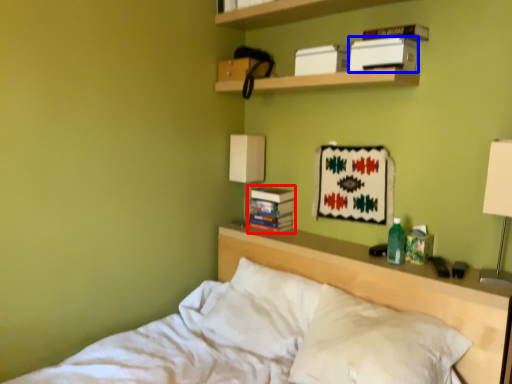
Question: Among these objects, which one is nearest to the camera, paperback book (highlighted by a red box) or paperback book (highlighted by a blue box)?

Choices:
 (A) paperback book
 (B) paperback book

Answer: (B)